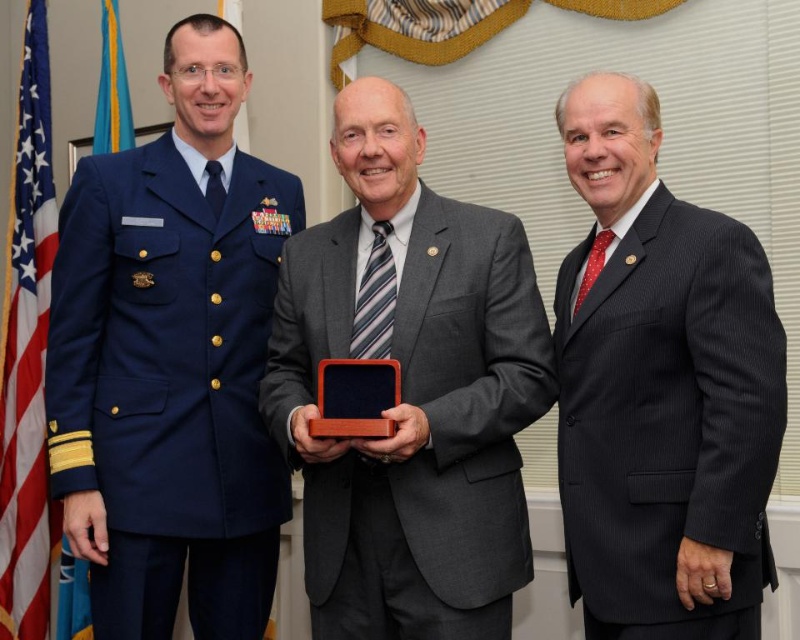
Question: Can you confirm if matte gray suit at center is positioned to the left of blue fabric flag at left?

Choices:
 (A) yes
 (B) no

Answer: (B)

Question: Is navy blue wool military uniform at left positioned behind dark gray pinstripe suit at center?

Choices:
 (A) yes
 (B) no

Answer: (A)

Question: Which object appears closest to the camera in this image?

Choices:
 (A) blue fabric flag at left
 (B) red fabric flag at left
 (C) matte gray suit at center

Answer: (C)

Question: Which object appears farthest from the camera in this image?

Choices:
 (A) red fabric flag at left
 (B) blue fabric flag at left
 (C) navy blue wool military uniform at left
 (D) dark gray pinstripe suit at center

Answer: (A)

Question: Does dark gray pinstripe suit at center appear under blue fabric flag at left?

Choices:
 (A) no
 (B) yes

Answer: (A)

Question: Which point is closer to the camera taking this photo?

Choices:
 (A) (128, 120)
 (B) (588, 428)
 (C) (516, 220)

Answer: (B)